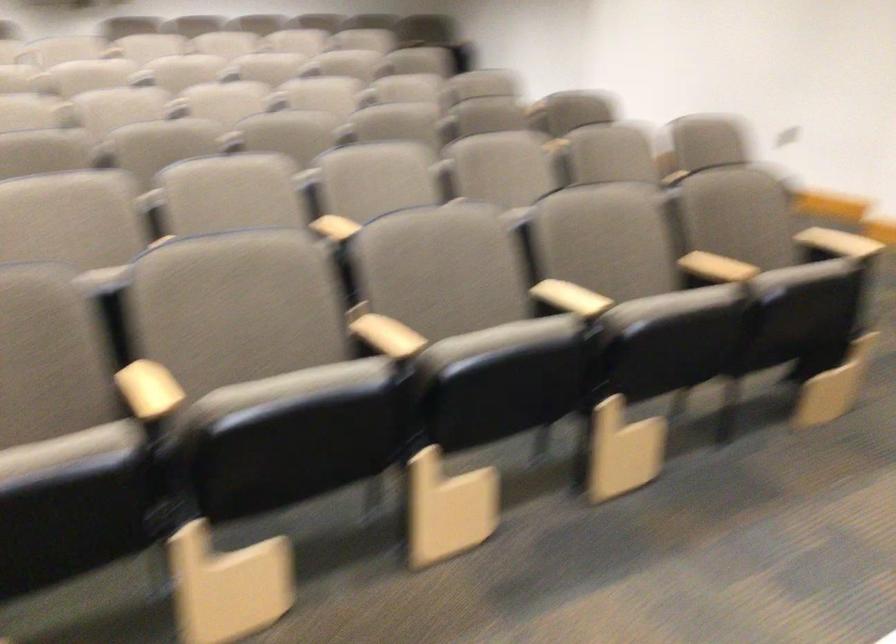
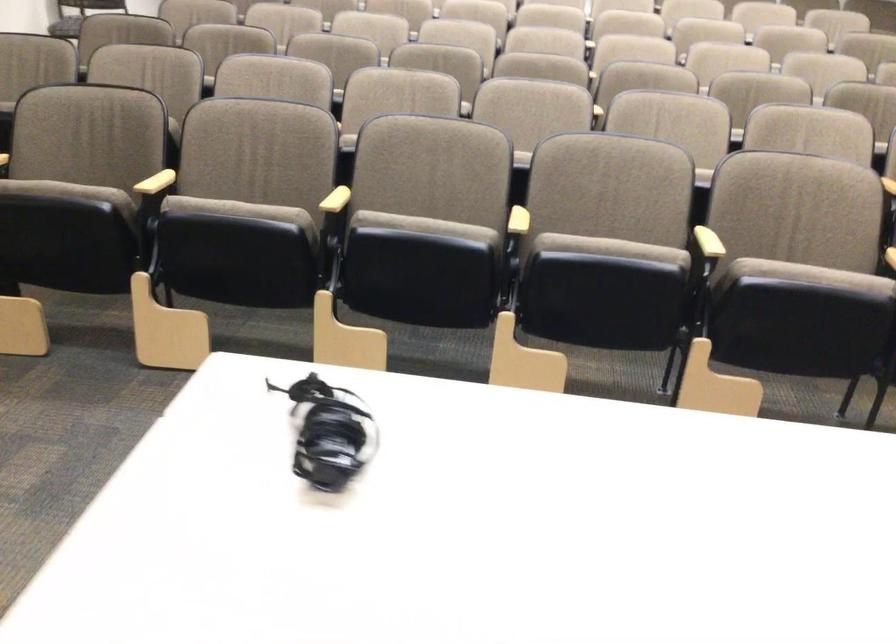
Where in the second image is the point corresponding to (388,345) from the first image?

(518, 221)